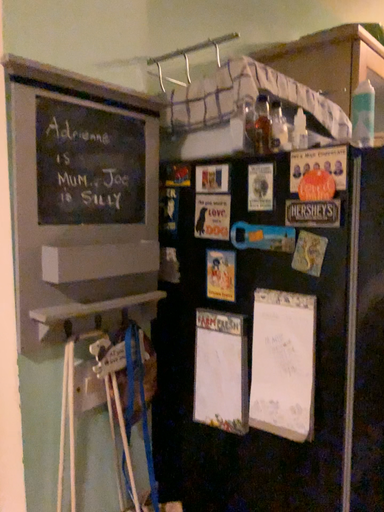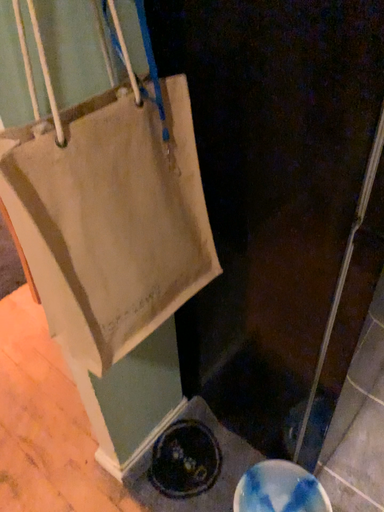
Question: Which way did the camera rotate in the video?

Choices:
 (A) rotated upward
 (B) rotated downward

Answer: (B)